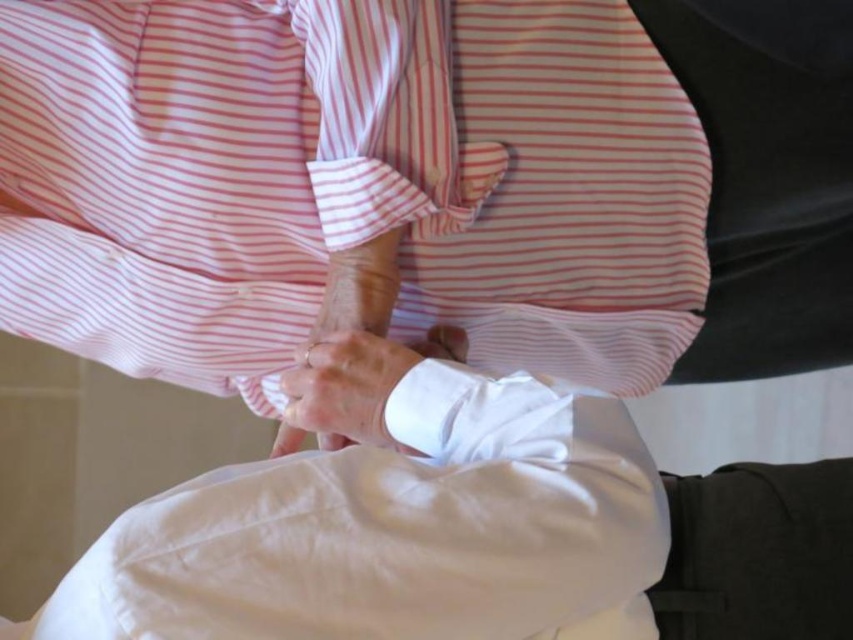
Between pink striped shirt at center and white satin hand at center, which one has less height?

white satin hand at center is shorter.

Can you confirm if pink striped shirt at center is positioned below white satin hand at center?

Actually, pink striped shirt at center is above white satin hand at center.

Which is behind, point (253, 136) or point (300, 420)?

The point (253, 136) is more distant.

Identify the location of pink striped shirt at center. The width and height of the screenshot is (853, 640). (347, 182).